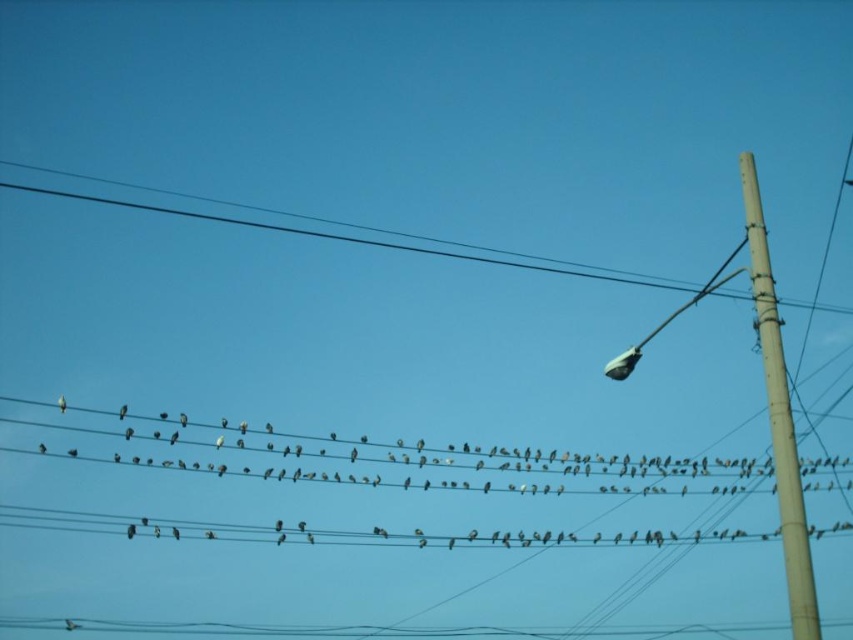
Between point (181, 524) and point (793, 573), which one is positioned behind?

Point (793, 573)

Can you confirm if white matte bird at center is smaller than smooth beige pole at right?

No, white matte bird at center is not smaller than smooth beige pole at right.

Who is more forward, (668, 474) or (766, 340)?

Point (766, 340)

This screenshot has height=640, width=853. Find the location of `white matte bird at center`. white matte bird at center is located at coordinates (378, 460).

Is smooth beige pole at right thinner than white feathered bird at left?

No, smooth beige pole at right is not thinner than white feathered bird at left.

Can you confirm if smooth beige pole at right is smaller than white feathered bird at left?

No, smooth beige pole at right is not smaller than white feathered bird at left.

Is point (780, 435) behind point (59, 404)?

Yes, it is behind point (59, 404).

Identify the location of smooth beige pole at right. This screenshot has width=853, height=640. (779, 416).

Can you confirm if white matte bird at center is thinner than white feathered bird at left?

No.

Is the position of white matte bird at center less distant than that of white feathered bird at left?

Yes.

Measure the distance between white matte bird at center and camera.

The distance of white matte bird at center from camera is 71.08 meters.

At what (x,y) coordinates should I click in order to perform the action: click on white matte bird at center. Please return your answer as a coordinate pair (x, y). Image resolution: width=853 pixels, height=640 pixels. Looking at the image, I should click on pos(378,460).